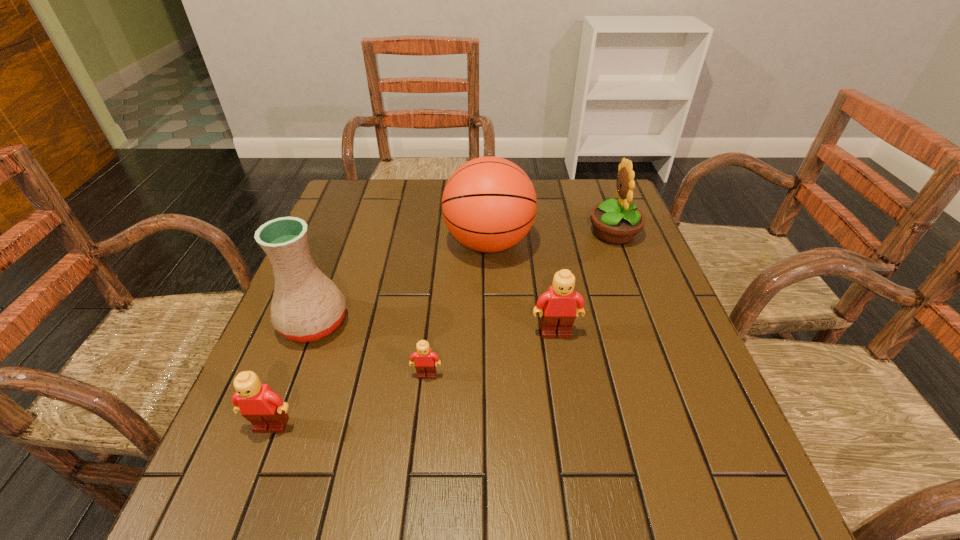
At what (x,y) coordinates should I click in order to perform the action: click on the nearest object. Please return your answer as a coordinate pair (x, y). Looking at the image, I should click on (265, 409).

Locate an element on the screen. Image resolution: width=960 pixels, height=540 pixels. the second shortest object is located at coordinates click(x=265, y=409).

This screenshot has height=540, width=960. In order to click on the shortest object in this screenshot , I will do `click(426, 362)`.

Locate an element on the screen. the second farthest Lego is located at coordinates (426, 362).

Where is `the farthest Lego`? This screenshot has height=540, width=960. the farthest Lego is located at coordinates (559, 311).

This screenshot has width=960, height=540. I want to click on basketball, so click(489, 204).

Where is `sunflower`? Image resolution: width=960 pixels, height=540 pixels. sunflower is located at coordinates (615, 222).

I want to click on pottery, so click(x=306, y=305).

Locate an element on the screen. vacant area located on the face of the second nearest Lego is located at coordinates (419, 448).

This screenshot has height=540, width=960. What are the coordinates of `vacant region located 0.160m on the face of the rightmost Lego` in the screenshot? It's located at (567, 407).